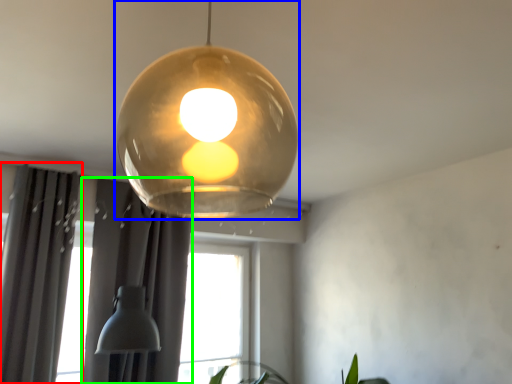
Question: Estimate the real-world distances between objects in this image. Which object is farther from curtain (highlighted by a red box), lamp (highlighted by a blue box) or curtain (highlighted by a green box)?

Choices:
 (A) lamp
 (B) curtain

Answer: (A)